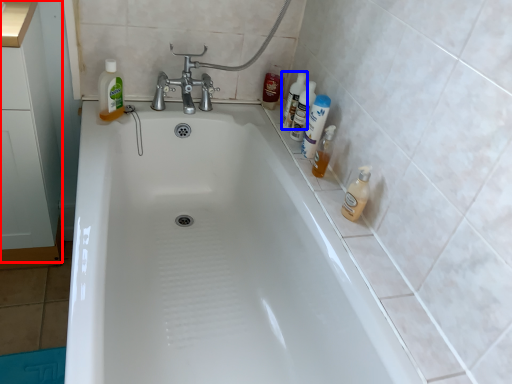
Question: Among these objects, which one is farthest to the camera, cabinetry (highlighted by a red box) or cleaning product (highlighted by a blue box)?

Choices:
 (A) cabinetry
 (B) cleaning product

Answer: (B)